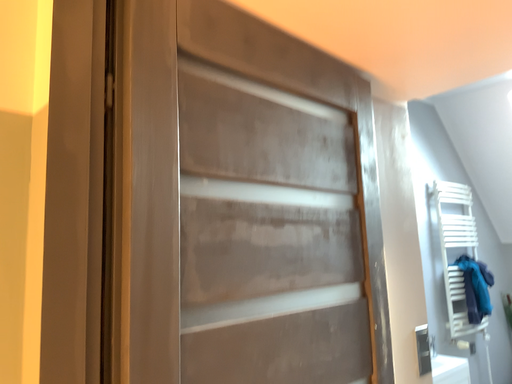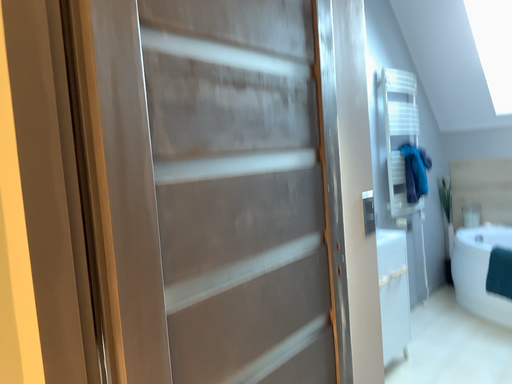
Question: Which way did the camera rotate in the video?

Choices:
 (A) rotated upward
 (B) rotated downward

Answer: (B)